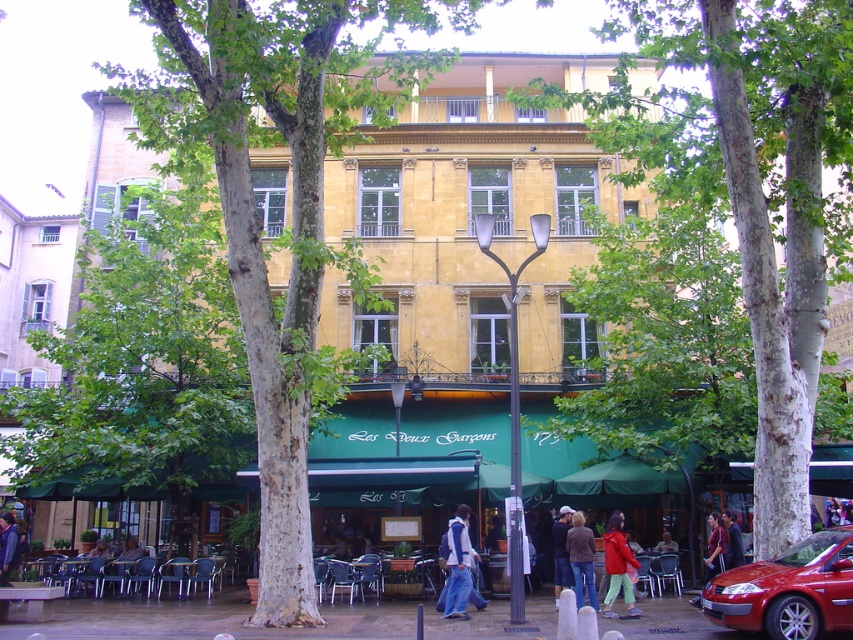
Question: Which of these objects is positioned closest to the dark blue jeans at center?

Choices:
 (A) paved stone pavement at center
 (B) shiny red car at lower right

Answer: (A)

Question: Which object is the closest to the green leafy tree at center?

Choices:
 (A) dark blue jeans at center
 (B) paved stone pavement at center
 (C) smooth white bark at center
 (D) denim jacket at center

Answer: (C)

Question: Can you confirm if dark purple sweater at lower left is positioned above dark brown leather jacket at center?

Choices:
 (A) yes
 (B) no

Answer: (A)

Question: Which object is the farthest from the denim jacket at lower center?

Choices:
 (A) green leafy tree at center
 (B) paved stone pavement at center

Answer: (A)

Question: From the image, what is the correct spatial relationship of smooth white bark at center in relation to paved stone pavement at center?

Choices:
 (A) left
 (B) right

Answer: (B)

Question: Is smooth white bark at center positioned in front of dark purple sweater at lower left?

Choices:
 (A) no
 (B) yes

Answer: (B)